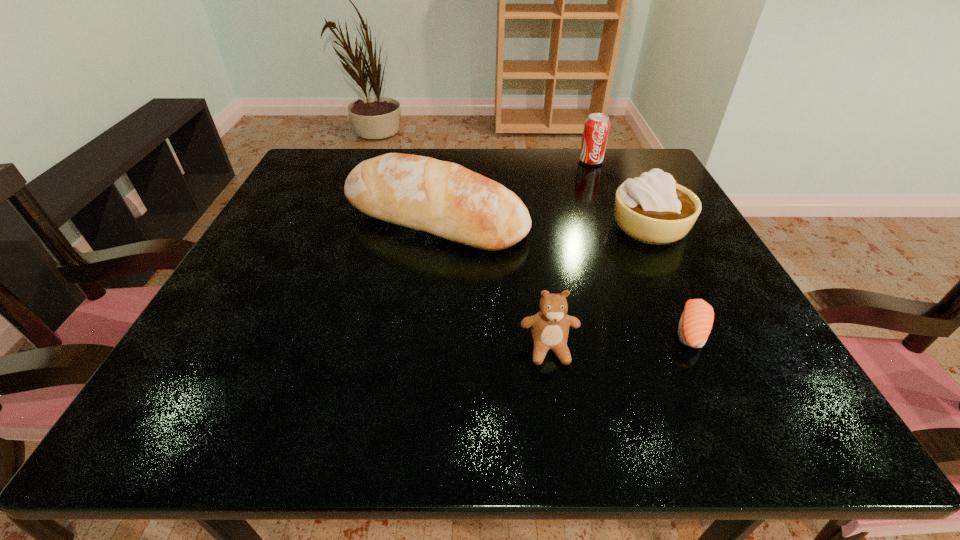
I want to click on vacant space at the right edge of the desktop, so click(x=680, y=241).

The image size is (960, 540). In the image, there is a desktop. What are the coordinates of `vacant space at the near left corner` in the screenshot? It's located at (245, 407).

Locate an element on the screen. Image resolution: width=960 pixels, height=540 pixels. vacant region at the far right corner of the desktop is located at coordinates (648, 172).

Identify the location of blank space at the near right corner of the desktop. The width and height of the screenshot is (960, 540). (732, 395).

Where is `empty space that is in between the bread and the farthest object`? empty space that is in between the bread and the farthest object is located at coordinates (513, 190).

Locate an element on the screen. This screenshot has height=540, width=960. unoccupied position between the farthest object and the shortest object is located at coordinates (640, 246).

Where is `vacant space that is in between the teddy bear and the whipped cream`? vacant space that is in between the teddy bear and the whipped cream is located at coordinates (599, 288).

The height and width of the screenshot is (540, 960). What are the coordinates of `free space between the bread and the soda can` in the screenshot? It's located at (513, 190).

Locate an element on the screen. free space between the teddy bear and the bread is located at coordinates (492, 284).

Where is `empty location between the whipped cream and the teddy bear`? The height and width of the screenshot is (540, 960). empty location between the whipped cream and the teddy bear is located at coordinates (599, 288).